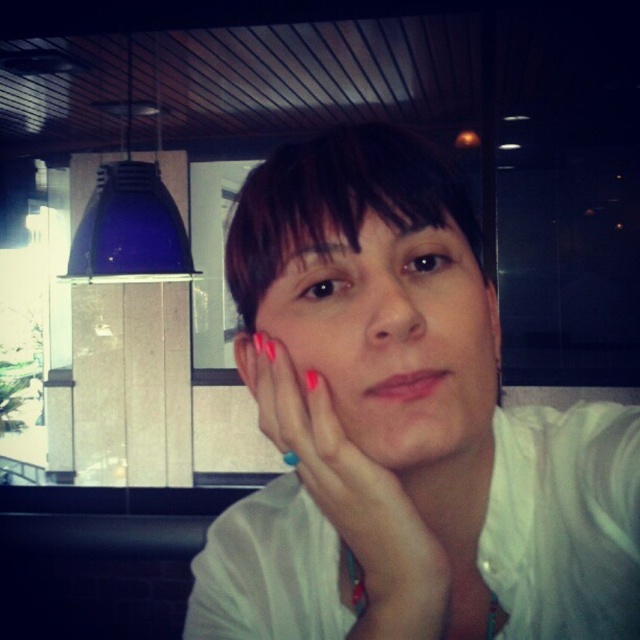
Who is more forward, (404, 310) or (394, 490)?

Point (404, 310) is in front.

Which is in front, point (436, 396) or point (365, 554)?

Positioned in front is point (436, 396).

Where is `matte white face at center`? Image resolution: width=640 pixels, height=640 pixels. matte white face at center is located at coordinates (392, 339).

Who is shorter, white matte shirt at center or pink nail polish at center?

Standing shorter between the two is pink nail polish at center.

Which is in front, point (611, 486) or point (429, 563)?

Point (429, 563) is in front.

I want to click on white matte shirt at center, so click(x=403, y=426).

Does white matte shirt at center appear on the left side of matte white face at center?

Incorrect, white matte shirt at center is not on the left side of matte white face at center.

Is white matte shirt at center closer to the viewer compared to matte white face at center?

Yes, it is in front of matte white face at center.

Locate an element on the screen. Image resolution: width=640 pixels, height=640 pixels. white matte shirt at center is located at coordinates (403, 426).

At what (x,y) coordinates should I click in order to perform the action: click on white matte shirt at center. Please return your answer as a coordinate pair (x, y). Looking at the image, I should click on (403, 426).